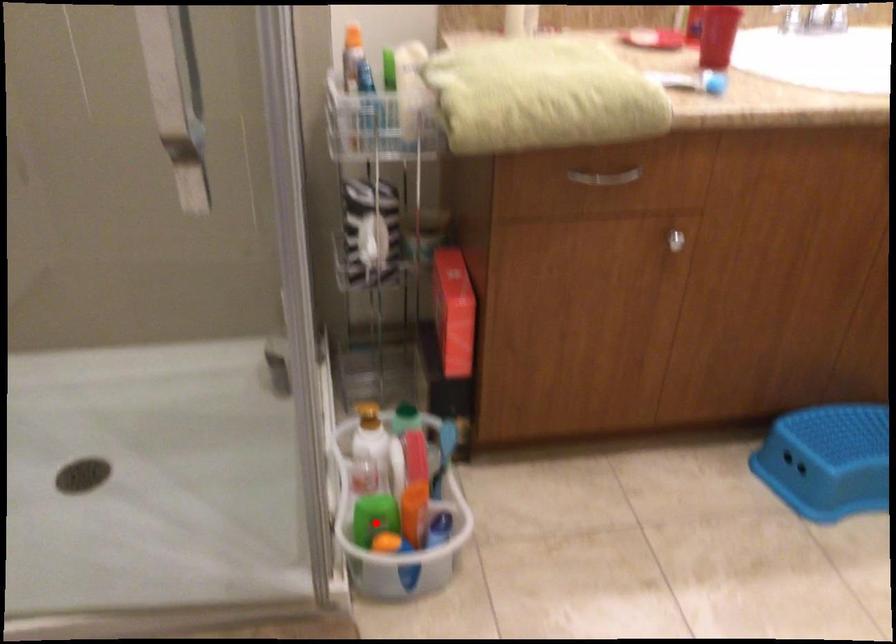
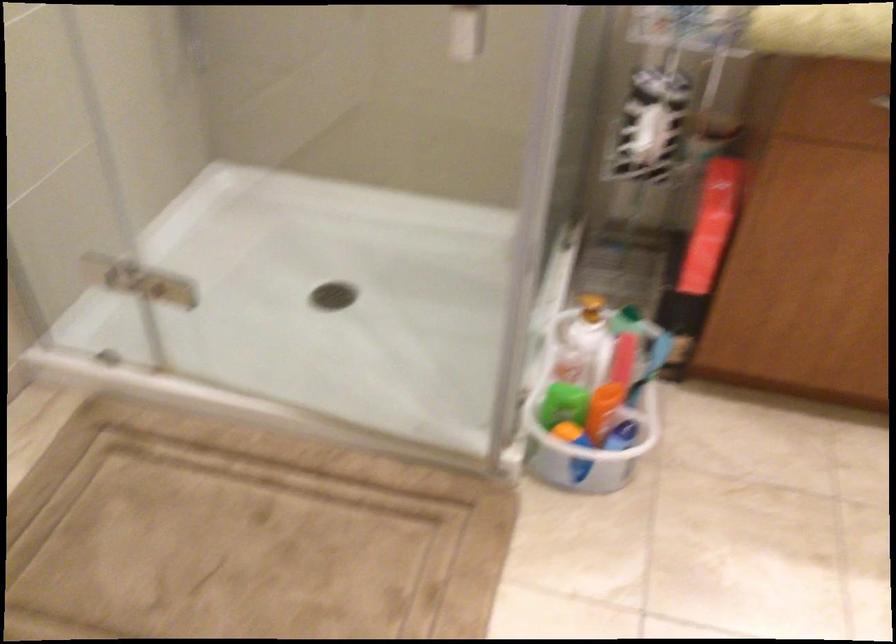
In the second image, find the point that corresponds to the highlighted location in the first image.

(563, 402)